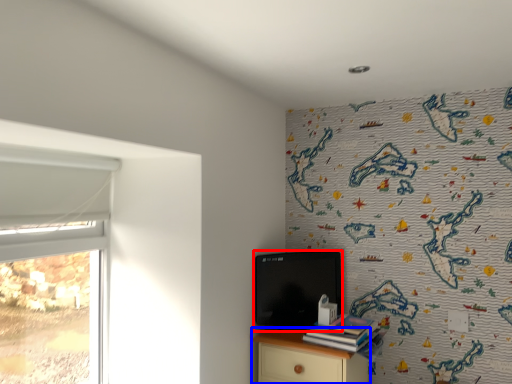
Question: Among these objects, which one is farthest to the camera, computer (highlighted by a red box) or nightstand (highlighted by a blue box)?

Choices:
 (A) computer
 (B) nightstand

Answer: (A)